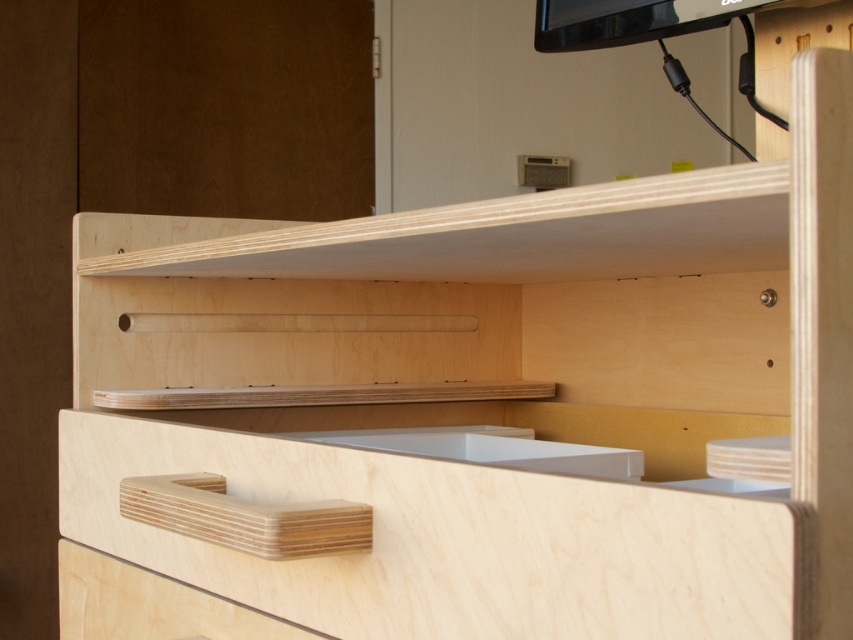
Question: Does natural wood drawer at lower center appear under white matte sink at center?

Choices:
 (A) no
 (B) yes

Answer: (B)

Question: Which of the following is the farthest from the observer?

Choices:
 (A) light wood drawer at lower left
 (B) natural wood drawer at lower center

Answer: (A)

Question: Which point is farther from the camera taking this photo?

Choices:
 (A) (401, 435)
 (B) (277, 580)

Answer: (A)

Question: Which of the following is the closest to the observer?

Choices:
 (A) (407, 436)
 (B) (129, 577)

Answer: (B)

Question: Observing the image, what is the correct spatial positioning of natural wood drawer at lower center in reference to light wood drawer at lower left?

Choices:
 (A) above
 (B) below

Answer: (A)

Question: Does light wood drawer at lower left have a greater width compared to white matte sink at center?

Choices:
 (A) no
 (B) yes

Answer: (A)